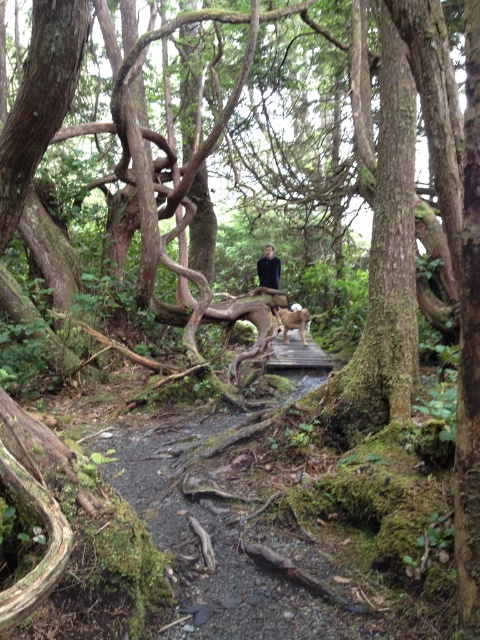
You are a hiker trying to cross the wooden bridge in the forest. There is a black matte shirt at center and a brown furry dog at center on the bridge. Which object is closer to the left side of the bridge?

The black matte shirt at center is closer to the left side of the bridge because it is positioned to the left of the brown furry dog at center.

You are a hiker who wants to take a photo of both the black matte shirt at center and the brown furry dog at center in the same frame. Given that your camera has a maximum focus range of 1.4 meters, will you be able to capture both subjects clearly in one shot?

The black matte shirt at center is 1.50 meters from the brown furry dog at center. Since the distance between them exceeds the camera maximum focus range of 1.4 meters, you won not be able to capture both subjects clearly in one shot.

You are a hiker navigating through the forest and spot a person wearing a black matte shirt at center. If you want to approach them, in which direction should you move relative to your current position at point 0,0?

The person wearing the black matte shirt at center is located at point [268,268], so you should move northeast to reach them.